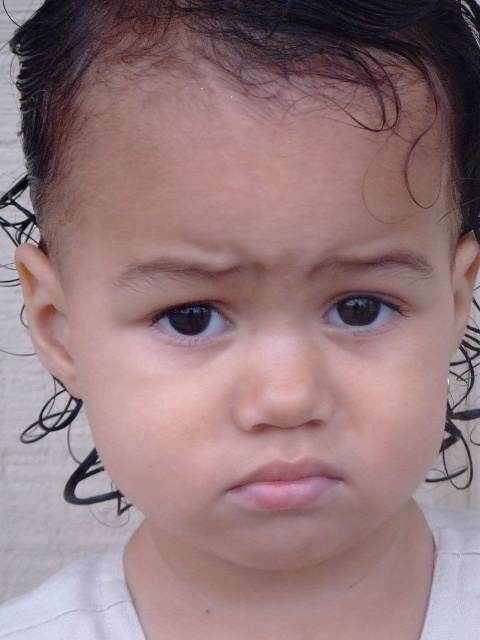
Consider the image. You are a photographer adjusting the focus on your camera. You notice two points in the image labeled as point (251, 490) and point (346, 320). Which point is nearer to your camera lens?

Point (251, 490) is closer to the camera lens than point (346, 320).

You are a photographer adjusting your camera settings. You need to ensure that the point at coordinates point [376,304] is in focus. What is the minimum distance you should set your camera focus to capture this point clearly?

The minimum distance to set the camera focus to capture the point [376,304] clearly is 10.18 inches, as that is the distance of the point from the camera.